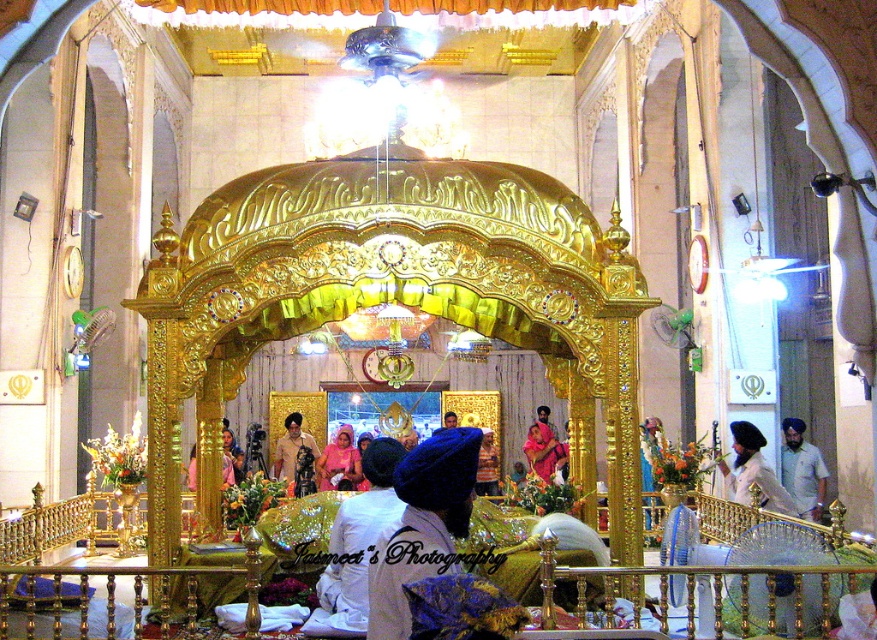
Question: Estimate the real-world distances between objects in this image. Which object is farther from the blue fabric turban at center?

Choices:
 (A) matte pink dress at center
 (B) light brown fabric turban at center

Answer: (B)

Question: Which object appears closest to the camera in this image?

Choices:
 (A) light brown fabric turban at center
 (B) white satin turban at center
 (C) matte white turban at center
 (D) matte blue turban at center

Answer: (B)

Question: Observing the image, what is the correct spatial positioning of blue fabric turban at center in reference to matte pink dress at center?

Choices:
 (A) below
 (B) above

Answer: (B)

Question: Considering the real-world distances, which object is closest to the matte white turban at center?

Choices:
 (A) matte pink dress at center
 (B) white satin turban at center
 (C) blue fabric turban at center
 (D) matte blue turban at center

Answer: (C)

Question: Can you confirm if light brown fabric turban at center is positioned above matte pink dress at center?

Choices:
 (A) yes
 (B) no

Answer: (B)

Question: Does blue fabric turban at center appear on the left side of light brown fabric turban at center?

Choices:
 (A) yes
 (B) no

Answer: (B)